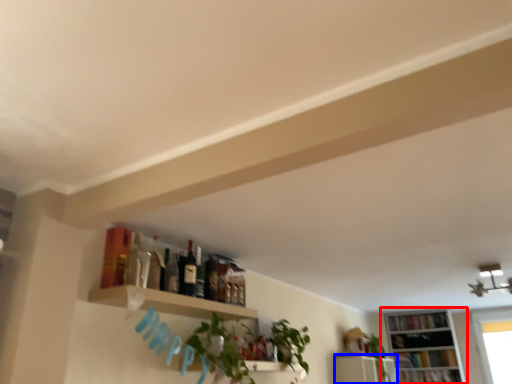
Question: Which point is closer to the camera, bookcase (highlighted by a red box) or shelf (highlighted by a blue box)?

Choices:
 (A) bookcase
 (B) shelf

Answer: (B)